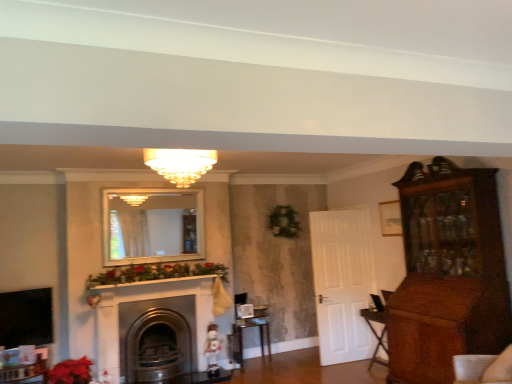
What do you see at coordinates (242, 336) in the screenshot? The image size is (512, 384). I see `metallic silver table at center` at bounding box center [242, 336].

Where is `metallic gold fireplace at center`? This screenshot has width=512, height=384. metallic gold fireplace at center is located at coordinates (151, 309).

This screenshot has height=384, width=512. I want to click on metallic silver table at center, so click(x=242, y=336).

Find the location of a particular element. table lying above the vivid red petals at lower left (from the image's perspective) is located at coordinates (242, 336).

Measure the distance between vivid red petals at lower left and metallic silver table at center.

vivid red petals at lower left is 7.02 feet from metallic silver table at center.

From the image's perspective, which one is positioned higher, vivid red petals at lower left or metallic silver table at center?

metallic silver table at center is shown above in the image.

Is vivid red petals at lower left bigger or smaller than metallic silver table at center?

vivid red petals at lower left is smaller than metallic silver table at center.

Based on the photo, considering the relative sizes of metallic silver table at center and matte glass chandelier at center in the image provided, is metallic silver table at center smaller than matte glass chandelier at center?

Correct, metallic silver table at center occupies less space than matte glass chandelier at center.

Find the location of a particular element. This screenshot has height=384, width=512. light fixture above the metallic silver table at center (from the image's perspective) is located at coordinates (180, 164).

Choose the correct answer: Is metallic silver table at center inside matte glass chandelier at center or outside it?

metallic silver table at center exists outside the volume of matte glass chandelier at center.

Which of these two, metallic silver table at center or matte glass chandelier at center, is thinner?

metallic silver table at center.

Is matte glass chandelier at center surrounding metallic gold fireplace at center?

Actually, metallic gold fireplace at center is outside matte glass chandelier at center.

From a real-world perspective, is matte glass chandelier at center under metallic gold fireplace at center?

No, from a real-world perspective, matte glass chandelier at center is not under metallic gold fireplace at center.

Looking at this image, is matte glass chandelier at center positioned far away from metallic gold fireplace at center?

matte glass chandelier at center is positioned a significant distance from metallic gold fireplace at center.

Could you tell me if matte glass chandelier at center is facing metallic gold fireplace at center?

No, matte glass chandelier at center is not facing towards metallic gold fireplace at center.

Find the location of a particular element. Image resolution: width=512 pixels, height=384 pixels. table behind the matte glass chandelier at center is located at coordinates (242, 336).

Would you consider matte glass chandelier at center to be distant from metallic silver table at center?

Absolutely, matte glass chandelier at center is distant from metallic silver table at center.

Is matte glass chandelier at center oriented away from metallic silver table at center?

No, matte glass chandelier at center is not facing the opposite direction of metallic silver table at center.

Considering the relative sizes of matte glass chandelier at center and metallic silver table at center in the image provided, is matte glass chandelier at center thinner than metallic silver table at center?

No, matte glass chandelier at center is not thinner than metallic silver table at center.

Are vivid red petals at lower left and metallic gold fireplace at center located far from each other?

They are positioned close to each other.

In the image, is vivid red petals at lower left on the left side or the right side of metallic gold fireplace at center?

From the image, it's evident that vivid red petals at lower left is to the left of metallic gold fireplace at center.

Which object is further away from the camera taking this photo, vivid red petals at lower left or metallic gold fireplace at center?

metallic gold fireplace at center is further away from the camera.

Can you tell me how much metallic gold fireplace at center and matte glass chandelier at center differ in facing direction?

0.496 degrees separate the facing orientations of metallic gold fireplace at center and matte glass chandelier at center.

From the image's perspective, which is above, metallic gold fireplace at center or matte glass chandelier at center?

From the image's view, matte glass chandelier at center is above.

Locate an element on the screen. The width and height of the screenshot is (512, 384). light fixture to the right of metallic gold fireplace at center is located at coordinates (180, 164).

From a real-world perspective, which is physically above, metallic gold fireplace at center or matte glass chandelier at center?

In real-world perspective, matte glass chandelier at center is above.

The height and width of the screenshot is (384, 512). I want to click on flower below the metallic gold fireplace at center (from a real-world perspective), so click(71, 372).

Between metallic gold fireplace at center and vivid red petals at lower left, which one is positioned in front?

vivid red petals at lower left is in front.

Is metallic gold fireplace at center shorter than vivid red petals at lower left?

Incorrect, the height of metallic gold fireplace at center does not fall short of that of vivid red petals at lower left.

Is point (194, 367) farther from camera compared to point (86, 375)?

Yes, point (194, 367) is behind point (86, 375).

Identify the location of flower on the left side of metallic silver table at center. (71, 372).

The image size is (512, 384). Find the location of `light fixture that appears above the metallic silver table at center (from a real-world perspective)`. light fixture that appears above the metallic silver table at center (from a real-world perspective) is located at coordinates (180, 164).

Considering their positions, is matte glass chandelier at center positioned further to metallic silver table at center than metallic gold fireplace at center?

matte glass chandelier at center is positioned further to the anchor metallic silver table at center.

Estimate the real-world distances between objects in this image. Which object is further from metallic silver table at center, matte glass chandelier at center or vivid red petals at lower left?

The object further to metallic silver table at center is matte glass chandelier at center.

Which object lies further to the anchor point metallic silver table at center, vivid red petals at lower left or matte glass chandelier at center?

matte glass chandelier at center.

Based on their spatial positions, is vivid red petals at lower left or metallic silver table at center closer to matte glass chandelier at center?

metallic silver table at center is closer to matte glass chandelier at center.

From the image, which object appears to be nearer to metallic silver table at center, metallic gold fireplace at center or vivid red petals at lower left?

metallic gold fireplace at center.

Considering their positions, is metallic silver table at center positioned closer to metallic gold fireplace at center than matte glass chandelier at center?

metallic silver table at center.

Based on their spatial positions, is metallic silver table at center or metallic gold fireplace at center further from vivid red petals at lower left?

metallic silver table at center is positioned further to the anchor vivid red petals at lower left.

Estimate the real-world distances between objects in this image. Which object is further from metallic gold fireplace at center, vivid red petals at lower left or matte glass chandelier at center?

The object further to metallic gold fireplace at center is matte glass chandelier at center.

Identify the location of fireplace between matte glass chandelier at center and vivid red petals at lower left in the vertical direction. (151, 309).

The width and height of the screenshot is (512, 384). Identify the location of table that lies between matte glass chandelier at center and vivid red petals at lower left from top to bottom. (242, 336).

Locate an element on the screen. fireplace between matte glass chandelier at center and metallic silver table at center from top to bottom is located at coordinates (151, 309).

The width and height of the screenshot is (512, 384). In order to click on fireplace between vivid red petals at lower left and metallic silver table at center from left to right in this screenshot , I will do `click(151, 309)`.